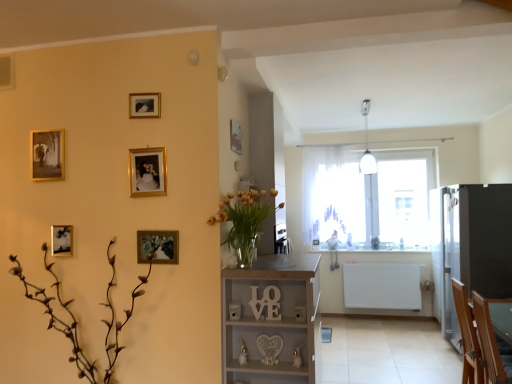
Question: In the image, is translucent glass vase at center on the left side or the right side of white sheer curtain at center?

Choices:
 (A) right
 (B) left

Answer: (B)

Question: In terms of size, does translucent glass vase at center appear bigger or smaller than white sheer curtain at center?

Choices:
 (A) big
 (B) small

Answer: (B)

Question: Which object is positioned farthest from the white wood shelf at center?

Choices:
 (A) white plastic light fixture at upper center
 (B) gold metallic picture frame at upper left, the fifth picture frame when ordered from right to left
 (C) satin black fridge at right
 (D) wooden armchair at lower right
 (E) wooden picture frame at center-left, which is the 6th picture frame from back to front

Answer: (A)

Question: Estimate the real-world distances between objects in this image. Which object is farther from the white wood shelf at center?

Choices:
 (A) wooden sign at center
 (B) gold metallic picture frame at upper left, which is the 2th picture frame in left-to-right order
 (C) white plastic light fixture at upper center
 (D) gold metallic picture frame at upper center, the sixth picture frame viewed from the front
 (E) brown matte plant at lower left

Answer: (C)